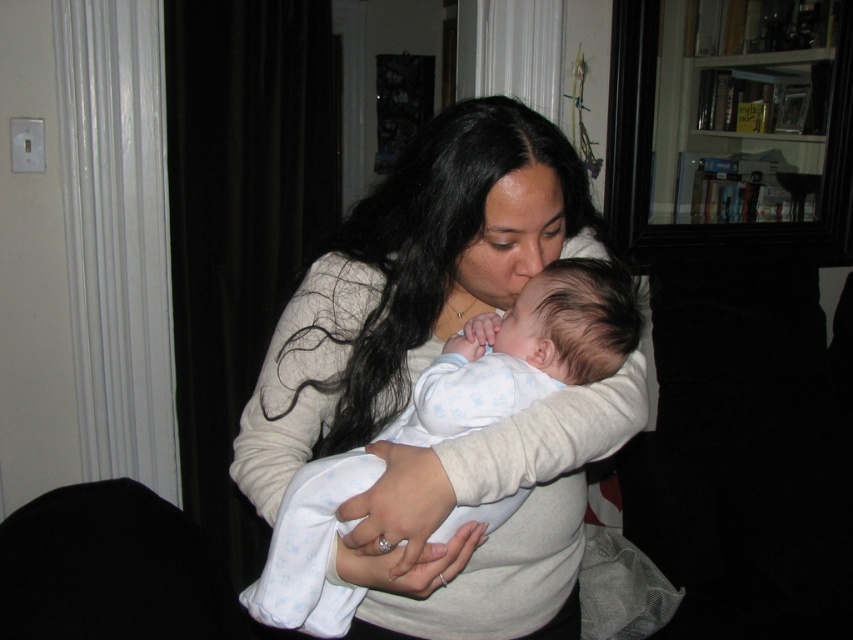
Question: Is white soft sweater at center to the left of white soft baby at center from the viewer's perspective?

Choices:
 (A) yes
 (B) no

Answer: (A)

Question: Is the position of white soft sweater at center less distant than that of white soft baby at center?

Choices:
 (A) no
 (B) yes

Answer: (B)

Question: Is white soft sweater at center positioned behind white soft baby at center?

Choices:
 (A) yes
 (B) no

Answer: (B)

Question: Among these objects, which one is nearest to the camera?

Choices:
 (A) white soft baby at center
 (B) white soft sweater at center

Answer: (B)

Question: Among these objects, which one is nearest to the camera?

Choices:
 (A) white soft sweater at center
 (B) white soft baby at center

Answer: (A)